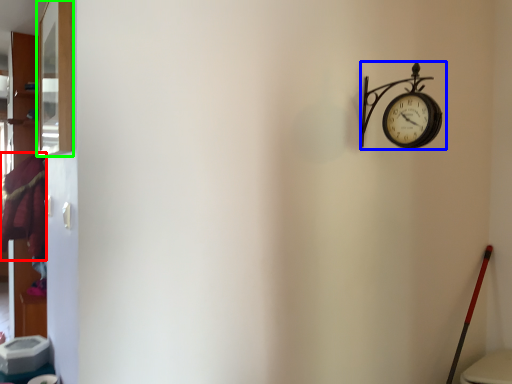
Question: Which is nearer to the laundry (highlighted by a red box)? wall clock (highlighted by a blue box) or window (highlighted by a green box).

Choices:
 (A) wall clock
 (B) window

Answer: (B)